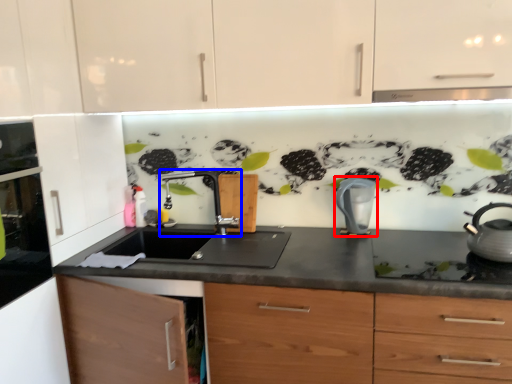
Question: Which object appears farthest to the camera in this image, kitchen appliance (highlighted by a red box) or tap (highlighted by a blue box)?

Choices:
 (A) kitchen appliance
 (B) tap

Answer: (B)